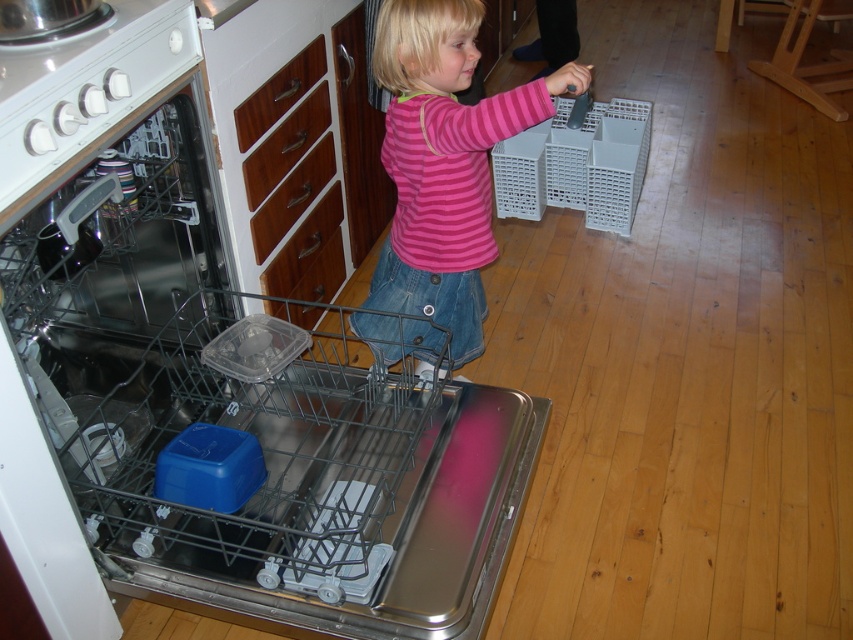
Between metallic dishwasher at center and pink striped shirt at center, which one has less height?

Standing shorter between the two is pink striped shirt at center.

Measure the distance between point (x=306, y=605) and camera.

Point (x=306, y=605) and camera are 1.47 meters apart from each other.

Is point (204, 211) less distant than point (408, 205)?

Yes, point (204, 211) is closer to viewer.

Identify the location of metallic dishwasher at center. click(x=228, y=424).